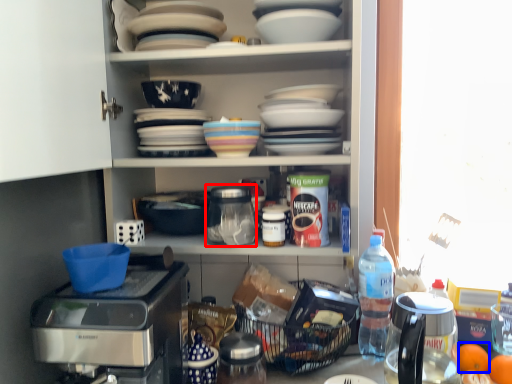
Question: Which of the following is the closest to the observer, appliance (highlighted by a red box) or tangerine (highlighted by a blue box)?

Choices:
 (A) appliance
 (B) tangerine

Answer: (A)